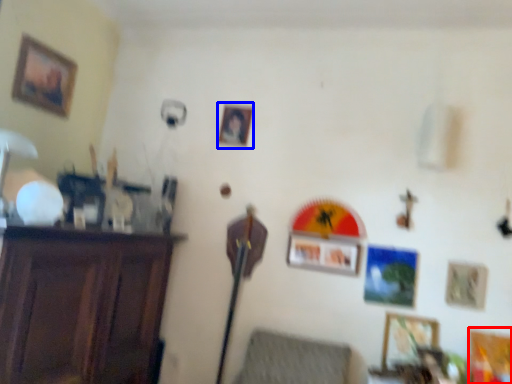
Question: Which point is closer to the camera, picture frame (highlighted by a red box) or picture frame (highlighted by a blue box)?

Choices:
 (A) picture frame
 (B) picture frame

Answer: (A)